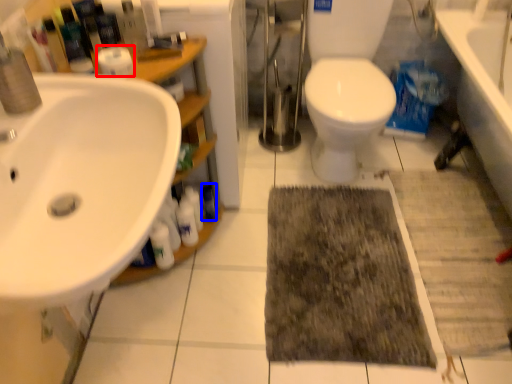
Question: Which object appears closest to the camera in this image, toilet paper (highlighted by a red box) or toiletry (highlighted by a blue box)?

Choices:
 (A) toilet paper
 (B) toiletry

Answer: (A)